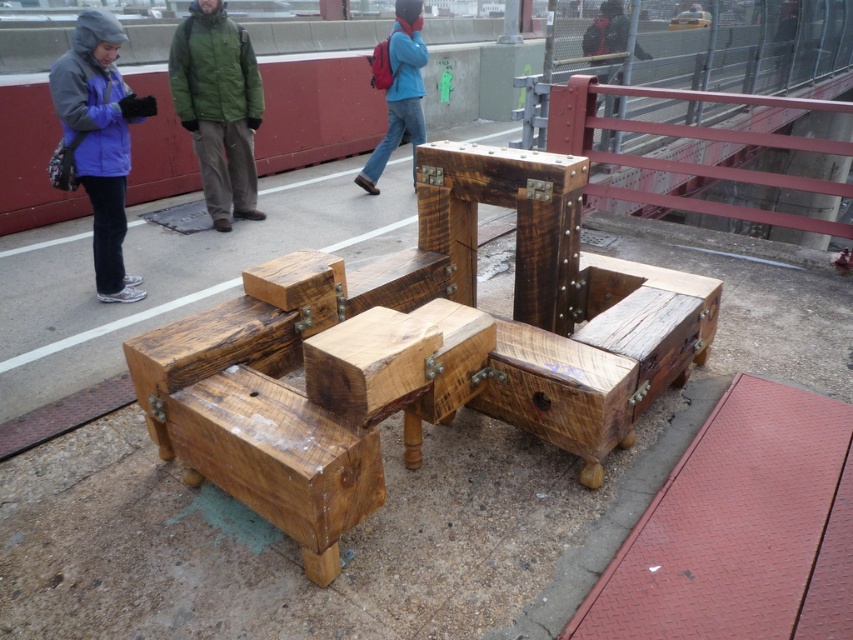
You are standing in the outdoor scene and want to place a small potted plant between the natural wood block at center and the blue denim jeans at center. Based on their positions, which object should the plant be closer to?

The natural wood block at center is in front of blue denim jeans at center, so the plant should be placed closer to the blue denim jeans at center to maintain the spatial relationship between them.

You are an artist planning to paint this scene. You want to ensure the purple fleece jacket at upper left and the blue denim jeans at center are proportionally accurate. Which object should you paint smaller to maintain the correct scale?

The purple fleece jacket at upper left should be painted smaller than the blue denim jeans at center because it has a smaller size compared to the blue denim jeans at center.

You are a photographer standing at the scene. You want to capture a photo that includes both the purple fleece jacket at upper left and the blue denim jeans at center. What is the minimum distance you need to move backward to ensure both subjects are in frame?

The minimum distance you need to move backward to include both the purple fleece jacket at upper left and the blue denim jeans at center is 2.57 meters.